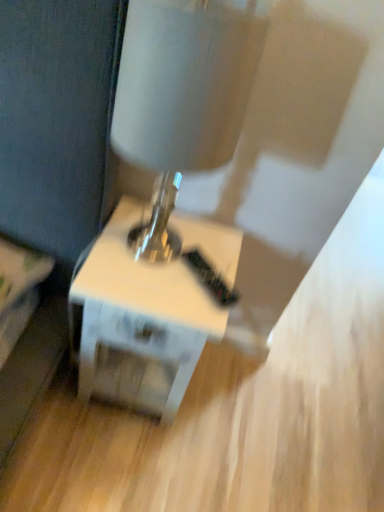
In order to click on vacant area that is in front of white glossy table at center in this screenshot , I will do `click(108, 459)`.